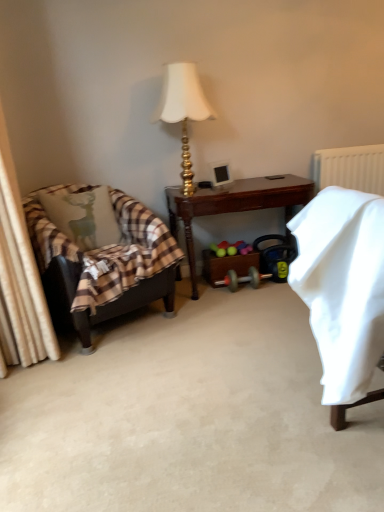
Question: Is gold metallic lamp at upper center wider than leather armchair at left?

Choices:
 (A) no
 (B) yes

Answer: (A)

Question: Is gold metallic lamp at upper center facing towards leather armchair at left?

Choices:
 (A) no
 (B) yes

Answer: (A)

Question: Is gold metallic lamp at upper center with leather armchair at left?

Choices:
 (A) yes
 (B) no

Answer: (B)

Question: Does gold metallic lamp at upper center have a lesser height compared to leather armchair at left?

Choices:
 (A) no
 (B) yes

Answer: (B)

Question: Are gold metallic lamp at upper center and leather armchair at left far apart?

Choices:
 (A) yes
 (B) no

Answer: (B)

Question: In terms of height, does brown wooden desk at center look taller or shorter compared to leather armchair at left?

Choices:
 (A) short
 (B) tall

Answer: (A)

Question: From a real-world perspective, is brown wooden desk at center positioned above or below leather armchair at left?

Choices:
 (A) above
 (B) below

Answer: (B)

Question: Based on their sizes in the image, would you say brown wooden desk at center is bigger or smaller than leather armchair at left?

Choices:
 (A) small
 (B) big

Answer: (A)

Question: Is point click(x=294, y=202) closer or farther from the camera than point click(x=112, y=202)?

Choices:
 (A) closer
 (B) farther

Answer: (B)

Question: Looking at the image, does brown wooden desk at center seem bigger or smaller compared to white plastic radiator at upper right?

Choices:
 (A) small
 (B) big

Answer: (B)

Question: In terms of width, does brown wooden desk at center look wider or thinner when compared to white plastic radiator at upper right?

Choices:
 (A) thin
 (B) wide

Answer: (B)

Question: Is brown wooden desk at center inside the boundaries of white plastic radiator at upper right, or outside?

Choices:
 (A) inside
 (B) outside

Answer: (B)

Question: Is brown wooden desk at center to the left or to the right of white plastic radiator at upper right in the image?

Choices:
 (A) left
 (B) right

Answer: (A)

Question: Is light green fabric pillow with deer print at left in front of or behind white plastic radiator at upper right in the image?

Choices:
 (A) behind
 (B) front

Answer: (B)

Question: Is light green fabric pillow with deer print at left bigger or smaller than white plastic radiator at upper right?

Choices:
 (A) small
 (B) big

Answer: (B)